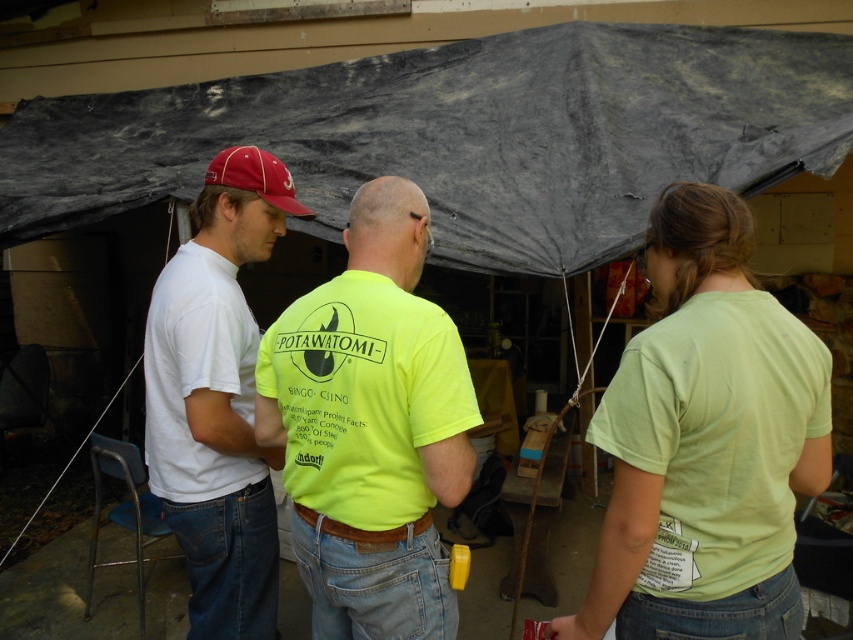
Who is positioned more to the left, lime green t-shirt at center or neon yellow t-shirt at center?

neon yellow t-shirt at center

What are the coordinates of `lime green t-shirt at center` in the screenshot? It's located at (706, 442).

Looking at this image, does white cotton t-shirt at left appear on the left side of matte red baseball cap at left?

Correct, you'll find white cotton t-shirt at left to the left of matte red baseball cap at left.

Is point (242, 339) positioned behind point (311, 212)?

No, it is not.

This screenshot has width=853, height=640. Identify the location of white cotton t-shirt at left. (218, 397).

Who is lower down, lime green t-shirt at center or matte red baseball cap at left?

lime green t-shirt at center is below.

Is point (561, 621) farther from camera compared to point (306, 211)?

No, (561, 621) is closer to viewer.

In order to click on lime green t-shirt at center in this screenshot , I will do `click(706, 442)`.